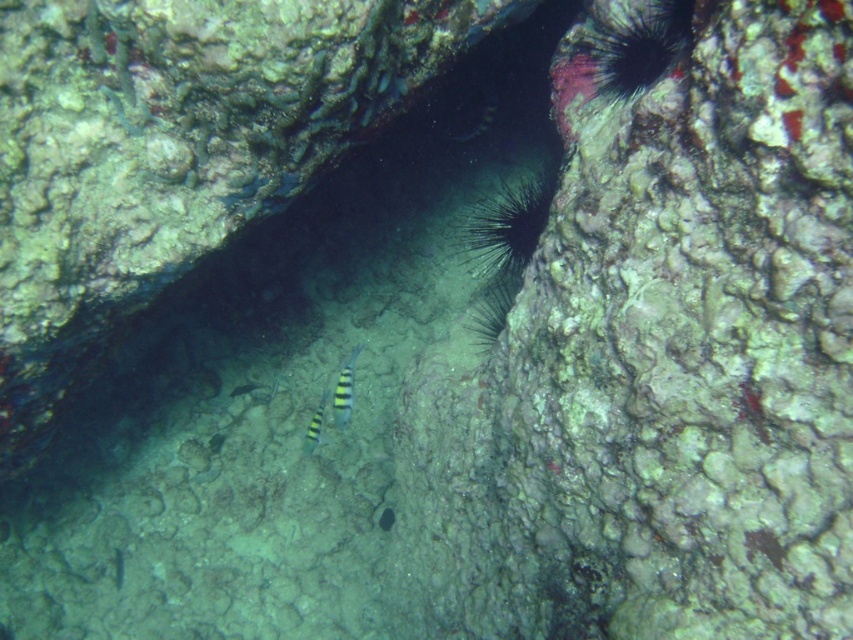
Between point (341, 403) and point (322, 417), which one is positioned in front?

Point (341, 403) is more forward.

Who is more distant from viewer, (335, 392) or (311, 424)?

Positioned behind is point (311, 424).

Locate an element on the screen. The height and width of the screenshot is (640, 853). multicolored striped fish at center is located at coordinates (344, 388).

Can you confirm if multicolored striped fish at center is positioned above yellow-green striped fish at center?

Yes, multicolored striped fish at center is above yellow-green striped fish at center.

Is multicolored striped fish at center closer to camera compared to yellow-green striped fish at center?

Yes, multicolored striped fish at center is closer to the viewer.

Image resolution: width=853 pixels, height=640 pixels. Find the location of `multicolored striped fish at center`. multicolored striped fish at center is located at coordinates (344, 388).

Is point (477, 128) farther from camera compared to point (252, 384)?

No, (477, 128) is closer to viewer.

Does yellow striped fish at center appear under yellow-green striped fish at center?

Incorrect, yellow striped fish at center is not positioned below yellow-green striped fish at center.

Is point (486, 125) behind point (248, 390)?

That is False.

Locate an element on the screen. yellow striped fish at center is located at coordinates (479, 124).